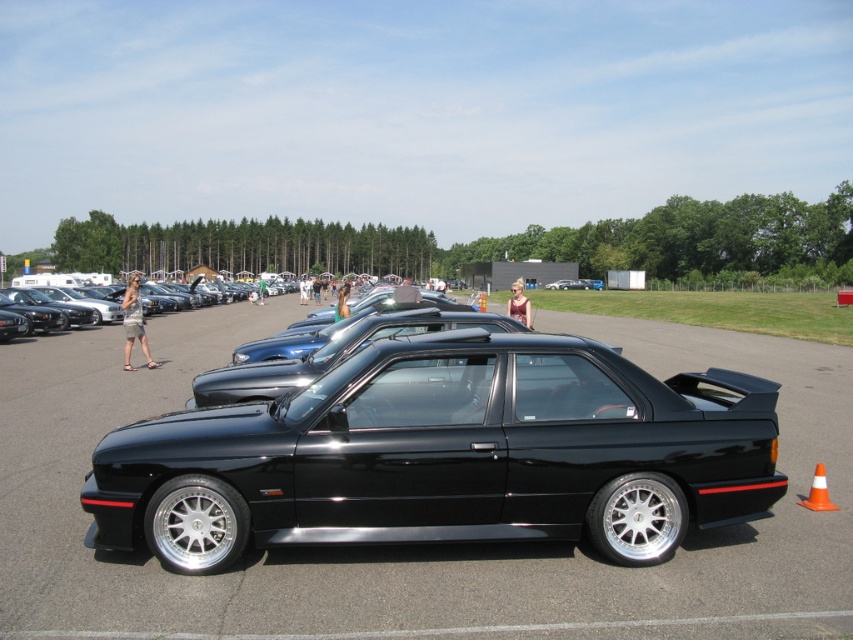
You are a photographer at the car exhibition. You want to take a photo of the black glossy sedan at center and denim shorts at center. Which object should be placed closer to the camera to ensure both are in focus?

The denim shorts at center should be placed closer to the camera because the black glossy sedan at center is taller than the denim shorts at center. To ensure both are in focus, the shorter object should be closer to the camera.